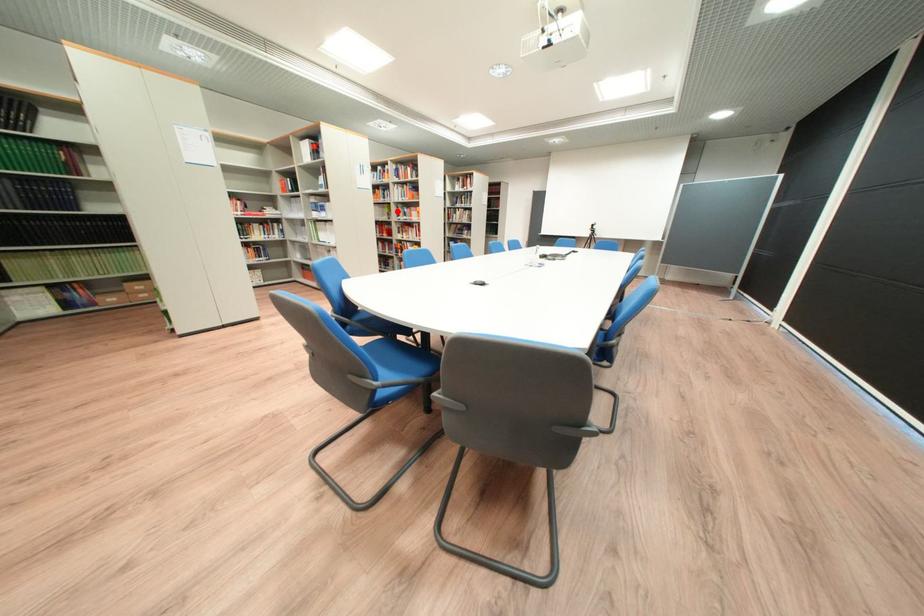
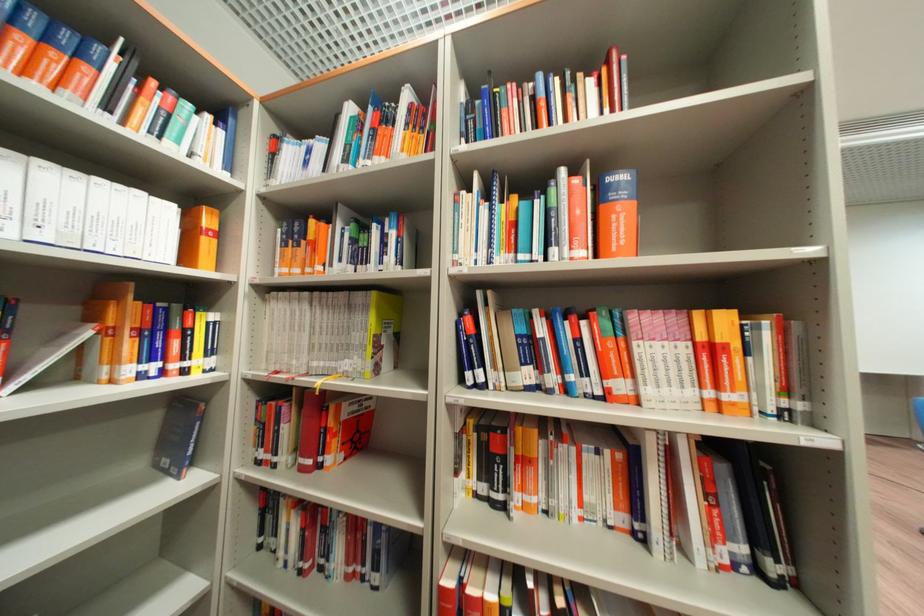
Where in the second image is the point corresponding to the highlighted location from the first image?

(380, 323)